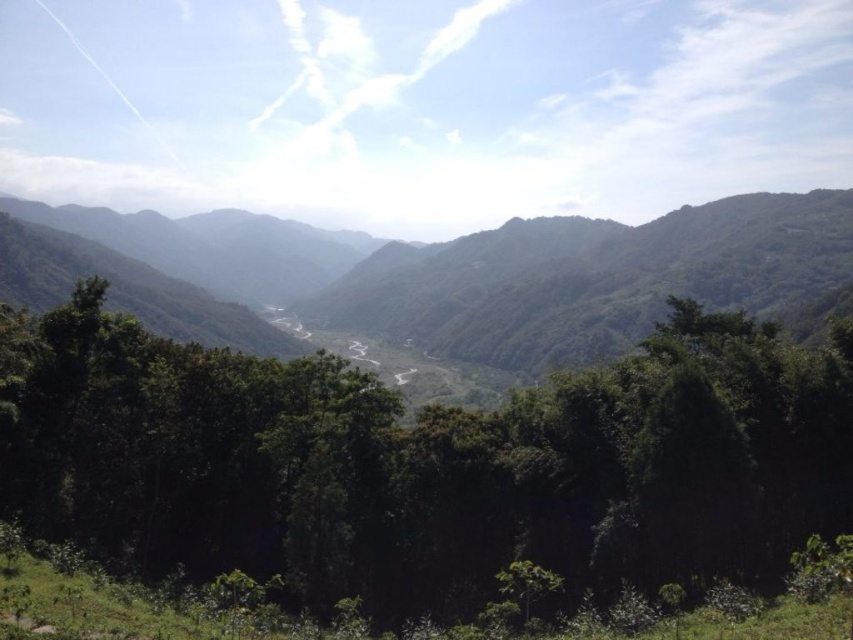
Question: Is green leafy tree at center behind green leafy mountain at center?

Choices:
 (A) yes
 (B) no

Answer: (B)

Question: Which of the following is the closest to the observer?

Choices:
 (A) green leafy mountain at center
 (B) green leafy tree at center

Answer: (B)

Question: Which object is closer to the camera taking this photo?

Choices:
 (A) green leafy mountain at center
 (B) green leafy tree at center

Answer: (B)

Question: Does green leafy tree at center appear over green leafy mountain at center?

Choices:
 (A) no
 (B) yes

Answer: (A)

Question: Among these objects, which one is nearest to the camera?

Choices:
 (A) green leafy tree at center
 (B) green leafy mountain at center

Answer: (A)

Question: Does green leafy tree at center have a lesser width compared to green leafy mountain at center?

Choices:
 (A) no
 (B) yes

Answer: (B)